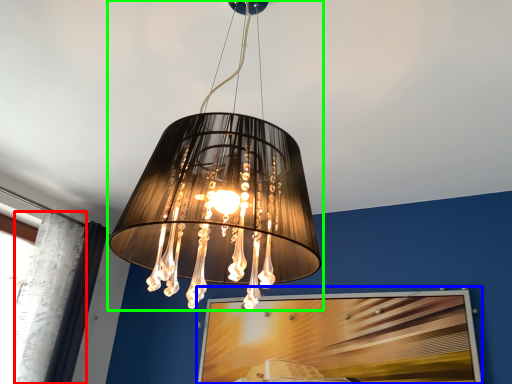
Question: Considering the real-world distances, which object is closest to curtain (highlighted by a red box)? picture frame (highlighted by a blue box) or lamp (highlighted by a green box).

Choices:
 (A) picture frame
 (B) lamp

Answer: (A)